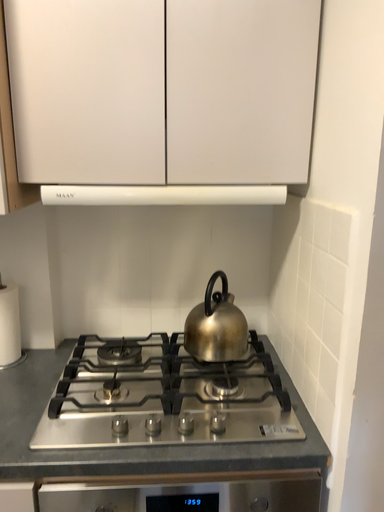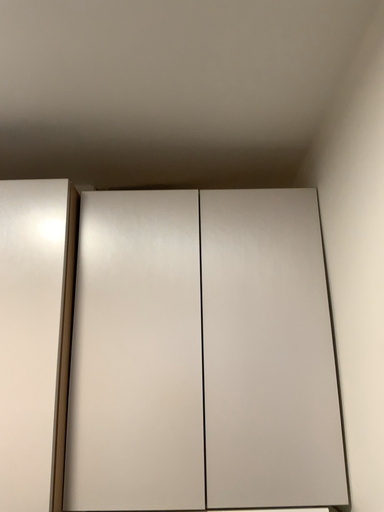
Question: How did the camera likely rotate when shooting the video?

Choices:
 (A) rotated upward
 (B) rotated downward

Answer: (A)